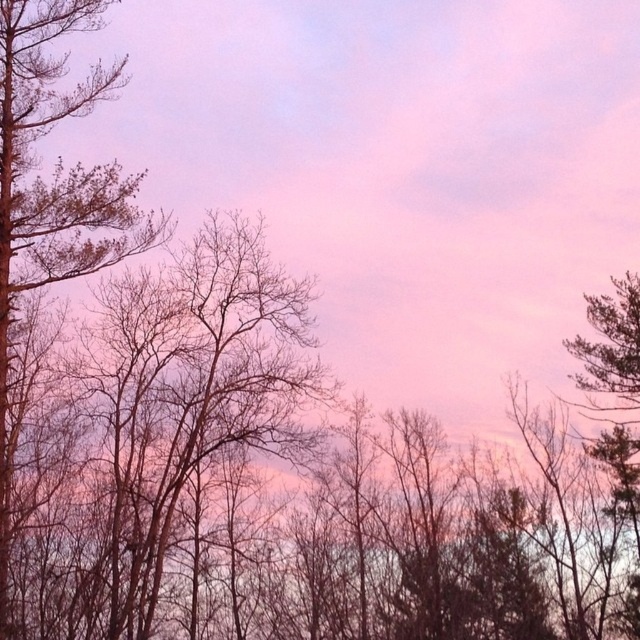
Does bare branches at left have a lesser height compared to dark green textured tree at right?

Correct, bare branches at left is not as tall as dark green textured tree at right.

Who is lower down, bare branches at left or dark green textured tree at right?

dark green textured tree at right

Find the location of a particular element. The image size is (640, 640). bare branches at left is located at coordinates (52, 186).

The height and width of the screenshot is (640, 640). Identify the location of bare branches at left. (52, 186).